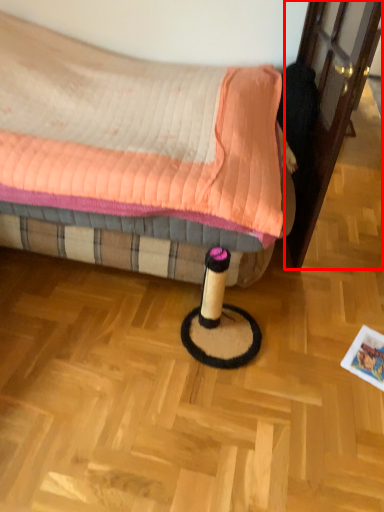
Question: From the image's perspective, considering the relative positions of screen door (annotated by the red box) and bed in the image provided, where is screen door (annotated by the red box) located with respect to the staircase?

Choices:
 (A) below
 (B) above

Answer: (B)